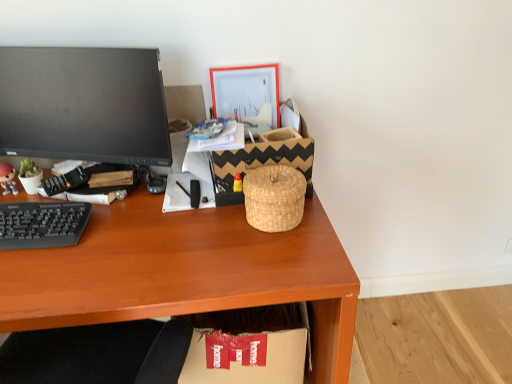
Question: Is matte plastic figurine at left located within black plastic keyboard at left?

Choices:
 (A) yes
 (B) no

Answer: (B)

Question: Considering the relative positions of black plastic keyboard at left and matte plastic figurine at left in the image provided, is black plastic keyboard at left behind matte plastic figurine at left?

Choices:
 (A) yes
 (B) no

Answer: (B)

Question: Is black plastic keyboard at left looking in the opposite direction of matte plastic figurine at left?

Choices:
 (A) yes
 (B) no

Answer: (B)

Question: Does black plastic keyboard at left have a larger size compared to matte plastic figurine at left?

Choices:
 (A) no
 (B) yes

Answer: (B)

Question: Is black plastic keyboard at left closer to the viewer compared to matte plastic figurine at left?

Choices:
 (A) no
 (B) yes

Answer: (B)

Question: From a real-world perspective, is black plastic keyboard at left positioned above or below cardboard box at lower center?

Choices:
 (A) below
 (B) above

Answer: (B)

Question: Is black plastic keyboard at left spatially inside cardboard box at lower center, or outside of it?

Choices:
 (A) inside
 (B) outside

Answer: (B)

Question: Does point (75, 228) appear closer or farther from the camera than point (295, 309)?

Choices:
 (A) farther
 (B) closer

Answer: (B)

Question: Considering their positions, is black plastic keyboard at left located in front of or behind cardboard box at lower center?

Choices:
 (A) front
 (B) behind

Answer: (A)

Question: From a real-world perspective, is cardboard box at lower center positioned above or below black plastic keyboard at left?

Choices:
 (A) above
 (B) below

Answer: (B)

Question: Is cardboard box at lower center bigger or smaller than black plastic keyboard at left?

Choices:
 (A) small
 (B) big

Answer: (B)

Question: From the image's perspective, is cardboard box at lower center located above or below black plastic keyboard at left?

Choices:
 (A) above
 (B) below

Answer: (B)

Question: Is cardboard box at lower center taller or shorter than black plastic keyboard at left?

Choices:
 (A) tall
 (B) short

Answer: (A)

Question: From their relative heights in the image, would you say black plastic keyboard at left is taller or shorter than matte plastic picture frame at upper center?

Choices:
 (A) short
 (B) tall

Answer: (A)

Question: Is point (58, 226) closer or farther from the camera than point (246, 84)?

Choices:
 (A) farther
 (B) closer

Answer: (B)